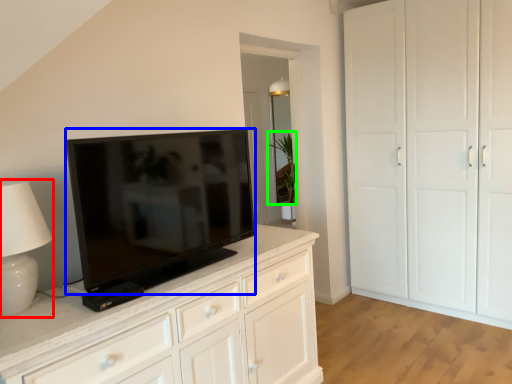
Question: Based on their relative distances, which object is nearer to table lamp (highlighted by a red box)? Choose from television (highlighted by a blue box) and plant (highlighted by a green box).

Choices:
 (A) television
 (B) plant

Answer: (A)